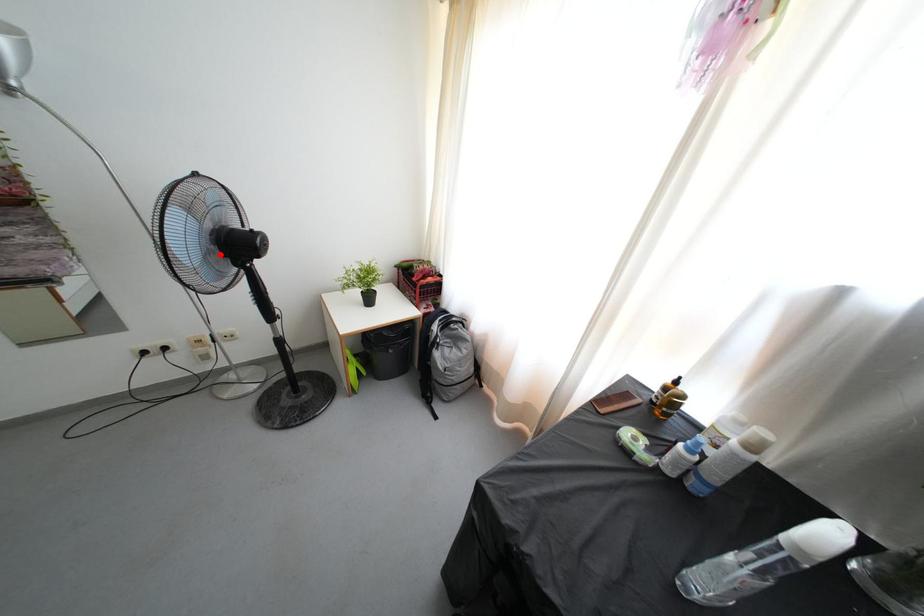
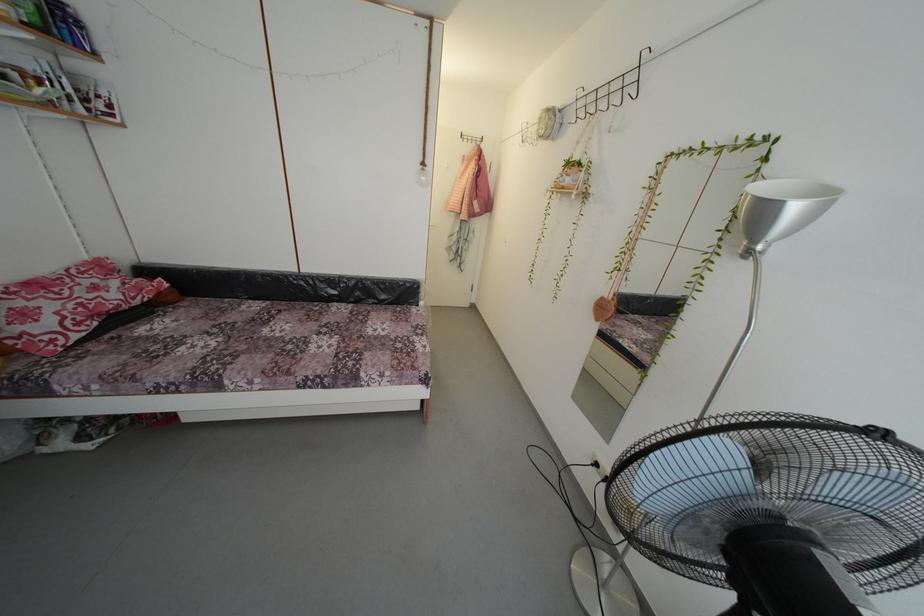
Where in the second image is the point corresponding to the highlighted location from the first image?

(723, 537)